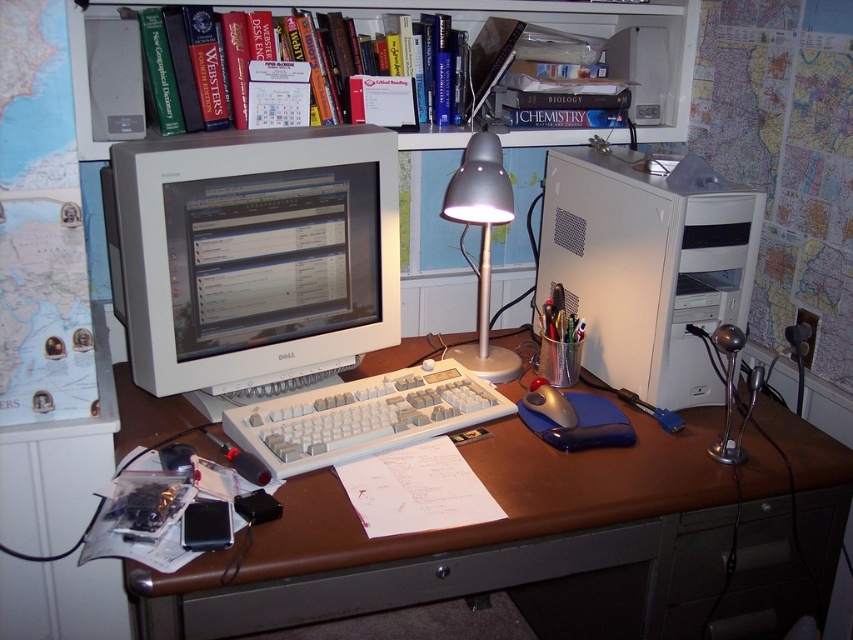
You are organizing your desk and want to place a new item between the metallic gray desk lamp at center and the matte gray mouse at center. Based on their current positions, which side of the mouse should you place the item to ensure it stays between them?

The metallic gray desk lamp at center is to the left of the matte gray mouse at center. Therefore, to place an item between them, you should position it to the left side of the matte gray mouse at center, between the lamp and the mouse.